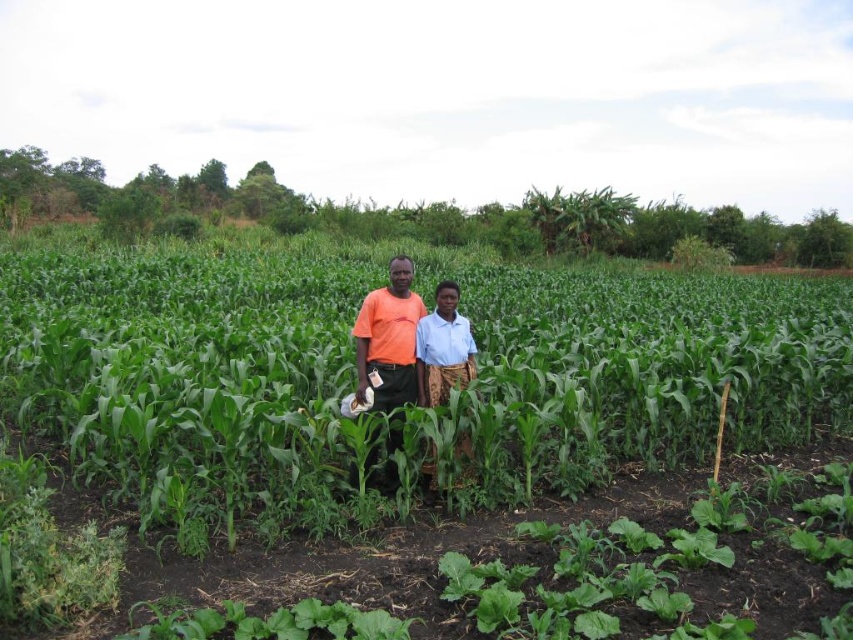
Question: Can you confirm if green leafy corn at center is positioned to the left of orange cotton shirt at center?

Choices:
 (A) yes
 (B) no

Answer: (B)

Question: Does green leafy corn at center appear over orange cotton shirt at center?

Choices:
 (A) yes
 (B) no

Answer: (A)

Question: Based on their relative distances, which object is farther from the orange cotton shirt at center?

Choices:
 (A) blue woven skirt at center
 (B) green leafy corn at center

Answer: (B)

Question: Can you confirm if green leafy corn at center is positioned below blue woven skirt at center?

Choices:
 (A) no
 (B) yes

Answer: (A)

Question: Which object is farther from the camera taking this photo?

Choices:
 (A) orange cotton shirt at center
 (B) green leafy corn at center

Answer: (A)

Question: Among these objects, which one is nearest to the camera?

Choices:
 (A) orange cotton shirt at center
 (B) green leafy corn at center
 (C) blue woven skirt at center

Answer: (B)